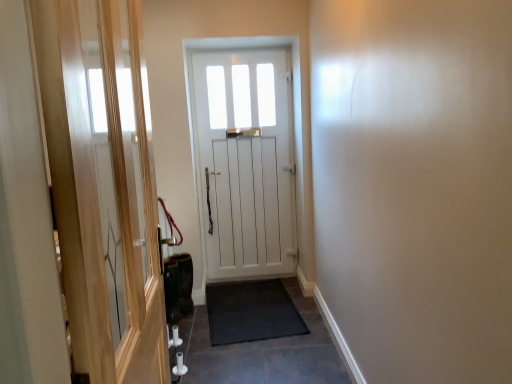
Question: Is transparent glass screen door at left inside or outside of white wooden door at center?

Choices:
 (A) inside
 (B) outside

Answer: (B)

Question: From the image's perspective, is transparent glass screen door at left above or below white wooden door at center?

Choices:
 (A) below
 (B) above

Answer: (A)

Question: Which object is positioned closest to the black rubber doormat at center?

Choices:
 (A) transparent glass screen door at left
 (B) black rubber mat at center
 (C) white wooden door at center

Answer: (B)

Question: Based on their relative distances, which object is nearer to the white wooden door at center?

Choices:
 (A) black rubber doormat at center
 (B) transparent glass screen door at left
 (C) black rubber mat at center

Answer: (A)